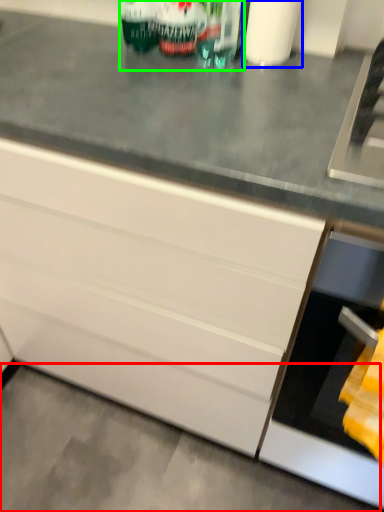
Question: Based on their relative distances, which object is nearer to concrete (highlighted by a red box)? Choose from toilet paper (highlighted by a blue box) and beverage (highlighted by a green box).

Choices:
 (A) toilet paper
 (B) beverage

Answer: (B)